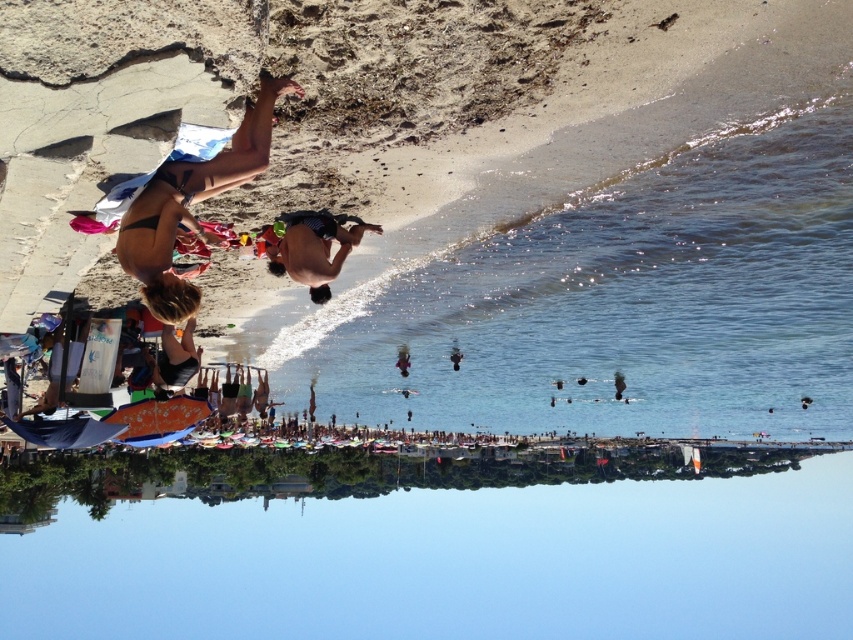
Question: Is the position of clear blue water at upper right less distant than that of black bikini at upper left?

Choices:
 (A) no
 (B) yes

Answer: (A)

Question: Which object is positioned farthest from the clear blue water at upper right?

Choices:
 (A) black bikini at upper left
 (B) smooth black swim trunks at center
 (C) matte black bikini at lower left

Answer: (C)

Question: Does black bikini at upper left appear on the right side of matte black bikini at lower left?

Choices:
 (A) yes
 (B) no

Answer: (A)

Question: Which point is closer to the camera?

Choices:
 (A) clear blue water at lower center
 (B) clear blue water at upper right
 (C) black bikini at upper left
 (D) matte black bikini at lower left

Answer: (C)

Question: Does clear blue water at lower center have a smaller size compared to black bikini at upper left?

Choices:
 (A) no
 (B) yes

Answer: (A)

Question: Which point is closer to the camera taking this photo?

Choices:
 (A) (160, 339)
 (B) (618, 486)

Answer: (A)